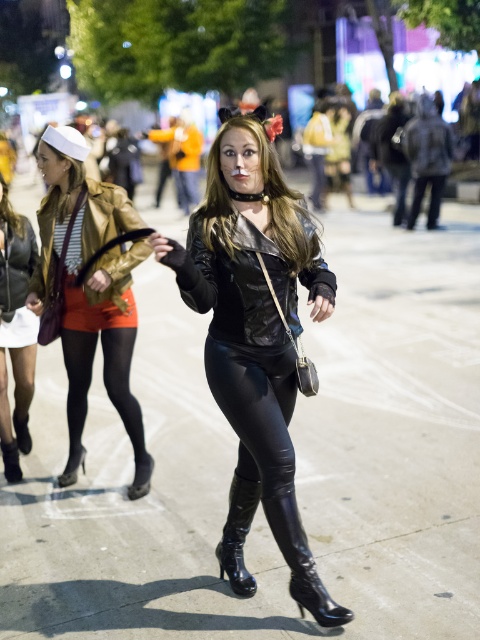
You are a photographer trying to capture the entire scene of the shiny black leather cat suit at center and the glossy black boot at lower center in one shot. Based on their sizes, which object should you focus on to ensure both are in frame without cropping?

The shiny black leather cat suit at center is much taller than the glossy black boot at lower center, so you should focus on the shiny black leather cat suit at center to ensure both are in frame without cropping.

You are standing at the center of the street and want to take a photo of both the point at (x=264, y=184) and the point at (x=252, y=484). Which point should you focus on first to ensure both are in focus?

You should focus on the point at (x=264, y=184) first because it is closer to the camera. By focusing on the closer point, the farther point at (x=252, y=484) will also be within the depth of field, ensuring both are in focus.

You are a photographer standing at the edge of the street. You want to take a photo of the shiny black leather outfit at center and the glossy patent leather boot at center so that both are in focus. Given that your camera has a depth of field that can sharply focus objects within a 20 inch range, will both subjects be in focus?

The shiny black leather outfit at center is 21.54 inches away from the glossy patent leather boot at center. Since the distance between them exceeds the camera sensor depth of field range of 20 inches, the two subjects cannot both be in focus at the same time.